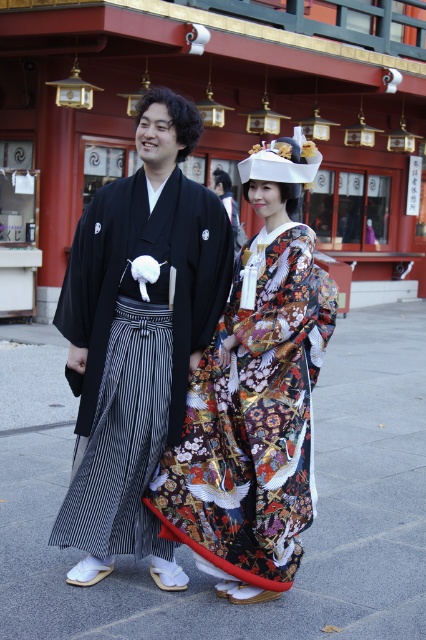
In the scene shown: You are a tailor who needs to determine which kimono requires a wider fabric roll for tailoring. Based on the image, which kimono between the black silk kimono at center and the colorful silk kimono at center has a greater width?

The black silk kimono at center has a greater width than the colorful silk kimono at center, so it requires a wider fabric roll.

You are a photographer standing in front of the building with red facade and decorative lanterns. You want to take a photo of both the black silk kimono at center and the colorful silk kimono at center. Which kimono should you focus on first to ensure it appears closer in the photo?

The black silk kimono at center is further to the viewer than colorful silk kimono at center, so you should focus on the black silk kimono at center first to ensure it appears closer in the photo.

You are a costume designer preparing for a traditional Japanese performance. You have two kimonos available for the lead roles. The black silk kimono at center and the colorful silk kimono at center. Which kimono would you choose if you need a larger garment for the main character?

The black silk kimono at center is bigger than the colorful silk kimono at center, so you should choose the black silk kimono at center for the main character who needs a larger garment.